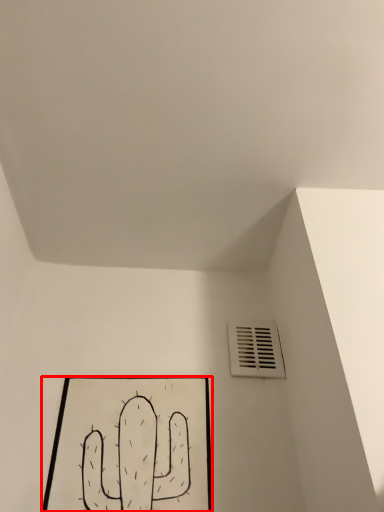
Question: Considering the relative positions of picture frame (annotated by the red box) and air conditioning in the image provided, where is picture frame (annotated by the red box) located with respect to the staircase?

Choices:
 (A) left
 (B) right

Answer: (A)